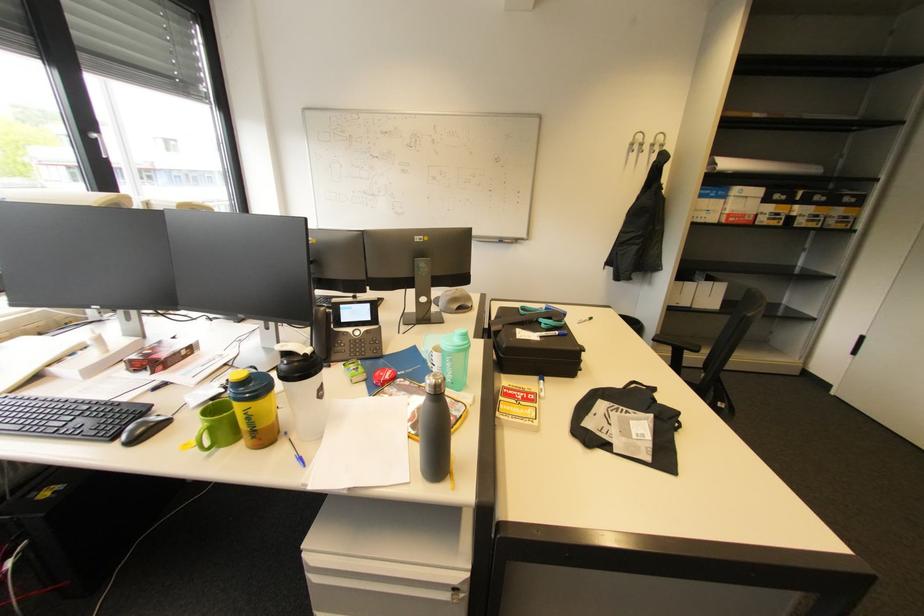
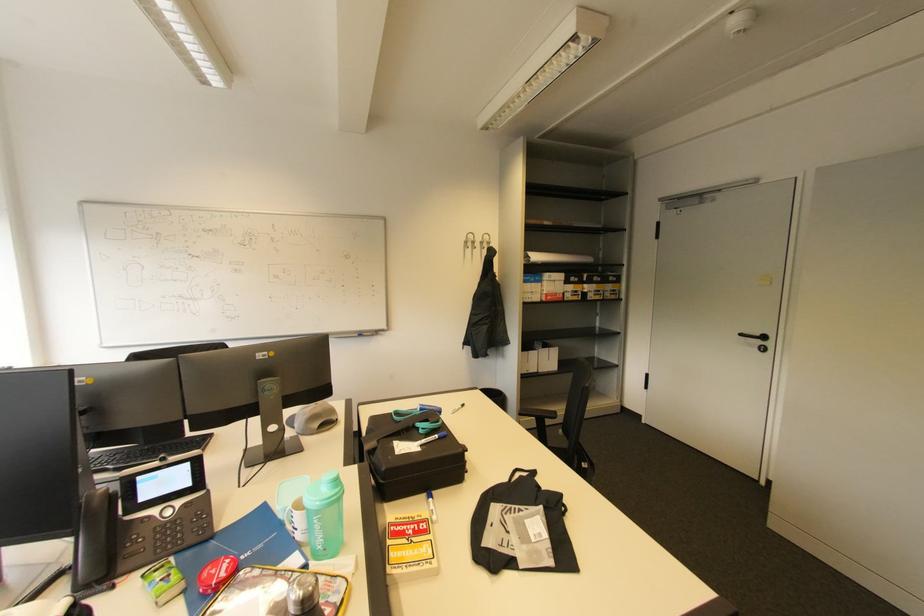
Find the pixel in the second image that matches point 637,146 in the first image.

(470, 243)